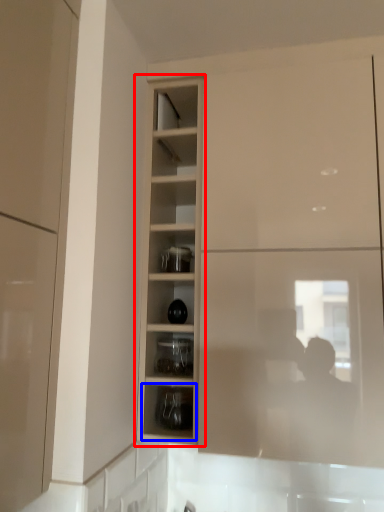
Question: Which of the following is the closest to the observer, cupboard (highlighted by a red box) or shelf (highlighted by a blue box)?

Choices:
 (A) cupboard
 (B) shelf

Answer: (A)